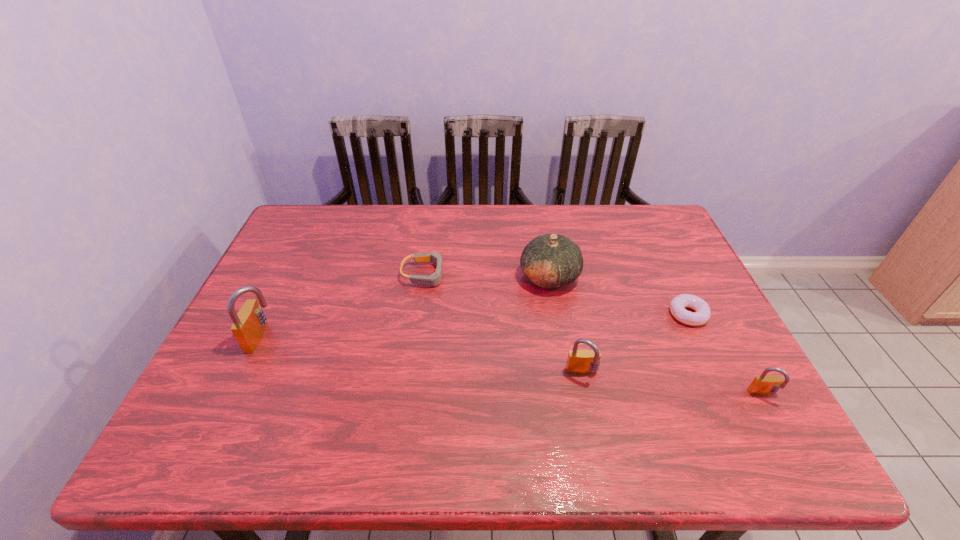
This screenshot has width=960, height=540. In order to click on the leftmost padlock in this screenshot , I will do point(249,324).

This screenshot has width=960, height=540. Find the location of `the tallest object`. the tallest object is located at coordinates (249, 324).

You are a GUI agent. You are given a task and a screenshot of the screen. Output one action in this format:
    pyautogui.click(x=<x>, y=<y>)
    Task: Click on the second padlock from left to right
    This screenshot has height=540, width=960.
    Given the screenshot: What is the action you would take?
    pyautogui.click(x=581, y=362)

Where is `the second nearest object`? The image size is (960, 540). the second nearest object is located at coordinates (581, 362).

This screenshot has height=540, width=960. I want to click on the nearest object, so click(x=764, y=384).

I want to click on the rightmost padlock, so click(x=764, y=384).

Identify the location of gourd. (549, 261).

Where is `the second object from left to right`? This screenshot has width=960, height=540. the second object from left to right is located at coordinates (434, 279).

This screenshot has width=960, height=540. I want to click on doughnut, so click(702, 313).

The height and width of the screenshot is (540, 960). In order to click on free space located on the side with the combination dials of the tallest padlock in this screenshot , I will do `click(327, 338)`.